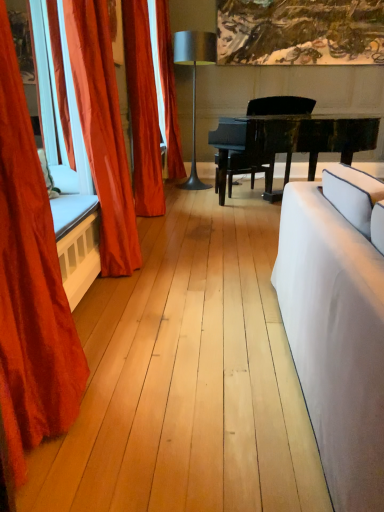
Question: From a real-world perspective, relative to metallic silver lamp at center, is white fabric couch at right vertically above or below?

Choices:
 (A) above
 (B) below

Answer: (B)

Question: Considering the positions of point (311, 245) and point (193, 55), is point (311, 245) closer or farther from the camera than point (193, 55)?

Choices:
 (A) farther
 (B) closer

Answer: (B)

Question: Estimate the real-world distances between objects in this image. Which object is closer to the metallic silver lamp at center?

Choices:
 (A) satin orange curtain at left, placed as the 3th curtain when sorted from back to front
 (B) velvet red curtain at left, marked as the 1th curtain in a front-to-back arrangement
 (C) black polished piano at center
 (D) white fabric couch at right
 (E) satin orange curtain at left, marked as the third curtain in a front-to-back arrangement

Answer: (C)

Question: Estimate the real-world distances between objects in this image. Which object is farther from the satin orange curtain at left, the 2th curtain in the front-to-back sequence?

Choices:
 (A) white fabric couch at right
 (B) metallic silver lamp at center
 (C) velvet red curtain at left, marked as the 1th curtain in a front-to-back arrangement
 (D) satin orange curtain at left, which is the second curtain from back to front
 (E) velvet orange curtain at center, which is the fourth curtain in front-to-back order

Answer: (B)